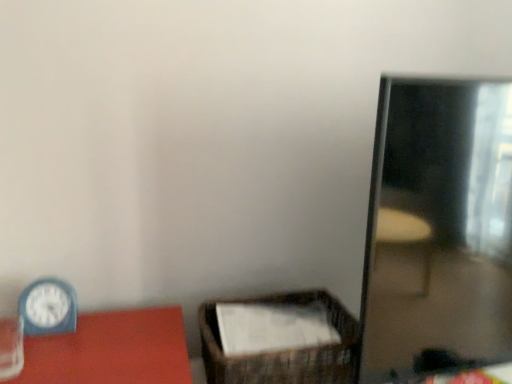
Question: Considering the relative sizes of shiny reflective mirror at right and brown woven basket at center in the image provided, is shiny reflective mirror at right shorter than brown woven basket at center?

Choices:
 (A) no
 (B) yes

Answer: (A)

Question: Does shiny reflective mirror at right have a larger size compared to brown woven basket at center?

Choices:
 (A) yes
 (B) no

Answer: (A)

Question: Is shiny reflective mirror at right taller than brown woven basket at center?

Choices:
 (A) no
 (B) yes

Answer: (B)

Question: Are shiny reflective mirror at right and brown woven basket at center far apart?

Choices:
 (A) no
 (B) yes

Answer: (A)

Question: Does shiny reflective mirror at right come in front of brown woven basket at center?

Choices:
 (A) no
 (B) yes

Answer: (B)

Question: From their relative heights in the image, would you say blue plastic clock at left is taller or shorter than brown woven basket at center?

Choices:
 (A) tall
 (B) short

Answer: (A)

Question: From the image's perspective, is blue plastic clock at left located above or below brown woven basket at center?

Choices:
 (A) above
 (B) below

Answer: (A)

Question: Based on their sizes in the image, would you say blue plastic clock at left is bigger or smaller than brown woven basket at center?

Choices:
 (A) big
 (B) small

Answer: (B)

Question: Is point (26, 307) closer or farther from the camera than point (212, 342)?

Choices:
 (A) closer
 (B) farther

Answer: (B)

Question: Visually, is blue plastic clock at left positioned to the left or to the right of shiny reflective mirror at right?

Choices:
 (A) right
 (B) left

Answer: (B)

Question: Is blue plastic clock at left spatially inside shiny reflective mirror at right, or outside of it?

Choices:
 (A) inside
 (B) outside

Answer: (B)

Question: Is blue plastic clock at left bigger or smaller than shiny reflective mirror at right?

Choices:
 (A) small
 (B) big

Answer: (A)

Question: Is blue plastic clock at left taller or shorter than shiny reflective mirror at right?

Choices:
 (A) short
 (B) tall

Answer: (A)

Question: Considering the positions of shiny reflective mirror at right and brown woven basket at center in the image, is shiny reflective mirror at right taller or shorter than brown woven basket at center?

Choices:
 (A) tall
 (B) short

Answer: (A)

Question: Relative to brown woven basket at center, is shiny reflective mirror at right in front or behind?

Choices:
 (A) front
 (B) behind

Answer: (A)